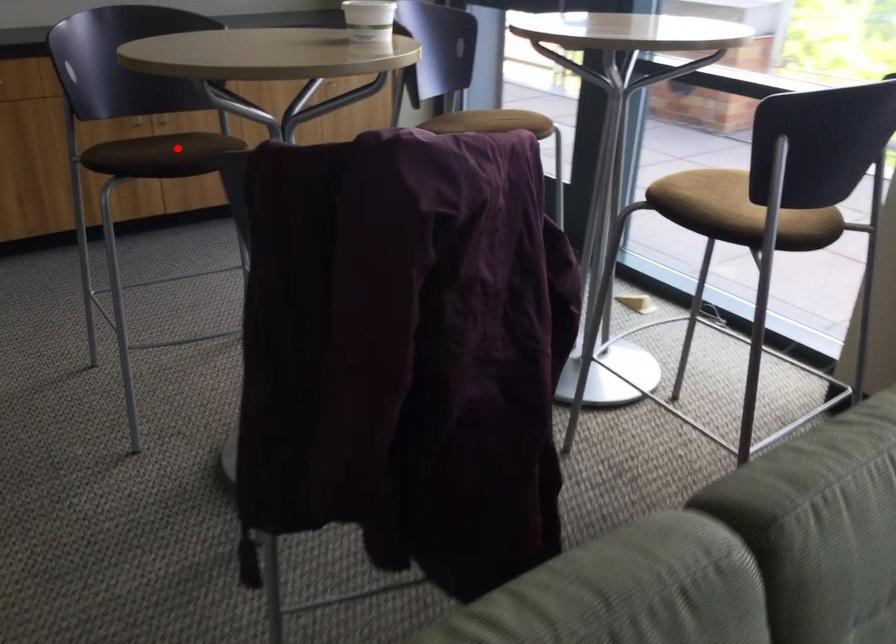
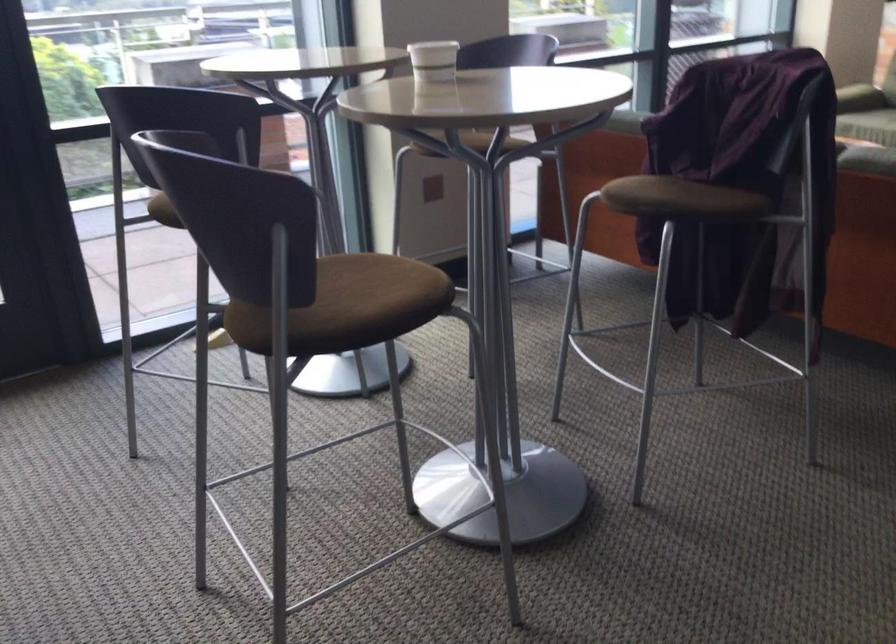
Question: I am providing you with two images of the same scene from different viewpoints. Given a red point in image1, look at the same physical point in image2. Is it:

Choices:
 (A) Closer to the viewpoint
 (B) Farther from the viewpoint

Answer: (A)